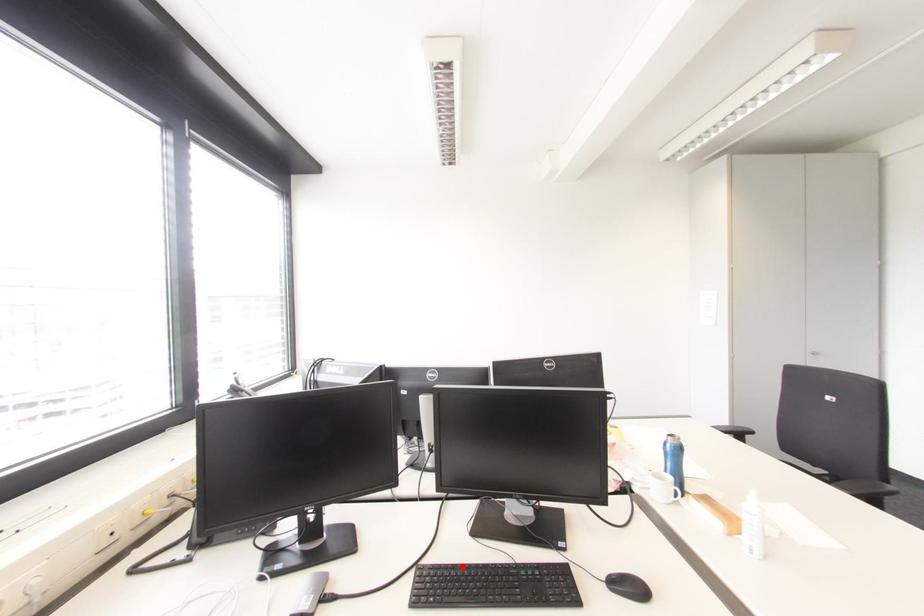
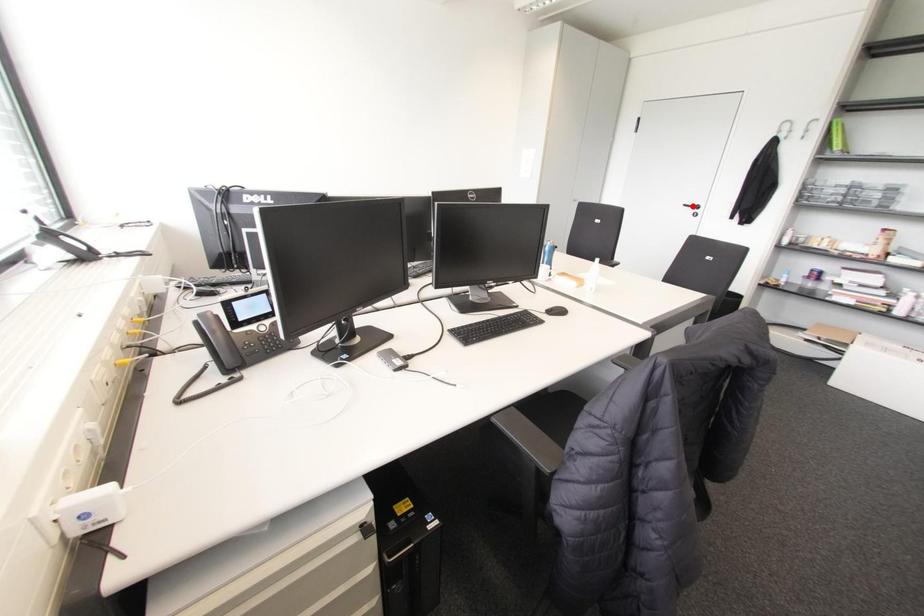
I am providing you with two images of the same scene from different viewpoints. A red point is marked on the first image and another point is marked on the second image. Are the points marked in image1 and image2 representing the same 3D position?

No